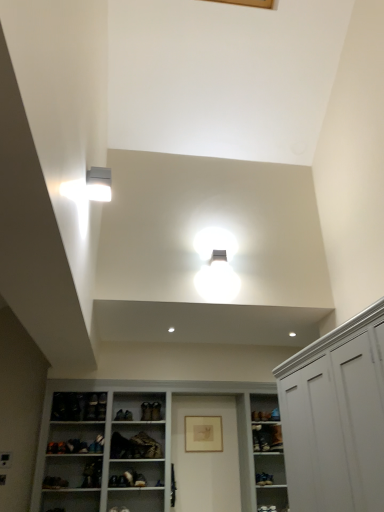
The height and width of the screenshot is (512, 384). In order to click on white plastic light fixture at upper left in this screenshot , I will do `click(98, 184)`.

What is the approximate width of white glossy cupboard at lower center?

white glossy cupboard at lower center is 15.46 inches in width.

Find the location of a particular element. The height and width of the screenshot is (512, 384). white glossy cupboard at lower center is located at coordinates (143, 445).

Where is `leather at center, the 1th shoe when ordered from left to right`? This screenshot has height=512, width=384. leather at center, the 1th shoe when ordered from left to right is located at coordinates (146, 411).

Is white glossy cupboard at lower center to the right of leather at center, acting as the second shoe starting from the right, from the viewer's perspective?

Yes.

Is white glossy cupboard at lower center far from leather at center, acting as the second shoe starting from the right?

No, white glossy cupboard at lower center is not far away from leather at center, acting as the second shoe starting from the right.

Considering the sizes of white glossy cupboard at lower center and leather at center, the 1th shoe when ordered from left to right, in the image, is white glossy cupboard at lower center wider or thinner than leather at center, the 1th shoe when ordered from left to right,?

Considering their sizes, white glossy cupboard at lower center looks broader than leather at center, the 1th shoe when ordered from left to right.

Who is bigger, white glossy cupboard at lower center or leather at center, the 1th shoe when ordered from left to right?

Bigger between the two is white glossy cupboard at lower center.

Is point (159, 411) closer or farther from the camera than point (322, 431)?

Point (159, 411) appears to be farther away from the viewer than point (322, 431).

Locate an element on the screen. cabinetry that is on the right side of leather shoe at center, which is the second shoe from left to right is located at coordinates (336, 418).

Is leather shoe at center, the first shoe when ordered from right to left, inside the boundaries of white matte cabinet at right, or outside?

leather shoe at center, the first shoe when ordered from right to left, is located beyond the bounds of white matte cabinet at right.

Is leather shoe at center, the first shoe when ordered from right to left, positioned in front of white matte cabinet at right?

No, it is not.

Are white matte cabinet at right and leather at center, the 1th shoe when ordered from left to right, making contact?

No.

Is white matte cabinet at right thinner than leather at center, acting as the second shoe starting from the right?

No, white matte cabinet at right is not thinner than leather at center, acting as the second shoe starting from the right.

Considering the relative positions of white matte cabinet at right and leather at center, the 1th shoe when ordered from left to right, in the image provided, is white matte cabinet at right to the right of leather at center, the 1th shoe when ordered from left to right, from the viewer's perspective?

Indeed, white matte cabinet at right is positioned on the right side of leather at center, the 1th shoe when ordered from left to right.

From their relative heights in the image, would you say white matte cabinet at right is taller or shorter than leather at center, the 1th shoe when ordered from left to right?

white matte cabinet at right is taller than leather at center, the 1th shoe when ordered from left to right.

From the picture: Is the depth of matte gold picture frame at center less than that of white plastic light fixture at upper left?

No, matte gold picture frame at center is further to the viewer.

Can you see matte gold picture frame at center touching white plastic light fixture at upper left?

No, matte gold picture frame at center is not beside white plastic light fixture at upper left.

Which is closer, (198, 433) or (105, 193)?

Point (198, 433) is positioned farther from the camera compared to point (105, 193).

Would you say matte gold picture frame at center is to the left or to the right of white plastic light fixture at upper left in the picture?

matte gold picture frame at center is positioned on white plastic light fixture at upper left's right side.

Who is smaller, white glossy cupboard at lower center or white matte cabinet at right?

Smaller between the two is white matte cabinet at right.

Is white glossy cupboard at lower center directly adjacent to white matte cabinet at right?

white glossy cupboard at lower center and white matte cabinet at right are not in contact.

How much distance is there between white glossy cupboard at lower center and white matte cabinet at right?

A distance of 6.64 feet exists between white glossy cupboard at lower center and white matte cabinet at right.

What's the angular difference between white glossy cupboard at lower center and white matte cabinet at right's facing directions?

The angular difference between white glossy cupboard at lower center and white matte cabinet at right is 90.8 degrees.

From a real-world perspective, which is physically below, white glossy cupboard at lower center or leather shoe at center, the first shoe when ordered from right to left?

white glossy cupboard at lower center.

You are a GUI agent. You are given a task and a screenshot of the screen. Output one action in this format:
    pyautogui.click(x=<x>, y=<y>)
    Task: Click on the 1st shoe counting from the left of the white glossy cupboard at lower center
    
    Given the screenshot: What is the action you would take?
    pyautogui.click(x=156, y=411)

What's the angular difference between white glossy cupboard at lower center and leather shoe at center, the first shoe when ordered from right to left,'s facing directions?

There is a 7.9-degree angle between the facing directions of white glossy cupboard at lower center and leather shoe at center, the first shoe when ordered from right to left.

Which of these two, white glossy cupboard at lower center or leather shoe at center, the first shoe when ordered from right to left, stands shorter?

Standing shorter between the two is leather shoe at center, the first shoe when ordered from right to left.

Which is behind, matte gold picture frame at center or white matte cabinet at right?

matte gold picture frame at center.

In terms of height, does matte gold picture frame at center look taller or shorter compared to white matte cabinet at right?

Considering their sizes, matte gold picture frame at center has less height than white matte cabinet at right.

Is the surface of matte gold picture frame at center in direct contact with white matte cabinet at right?

No, matte gold picture frame at center is not making contact with white matte cabinet at right.

From a real-world perspective, does matte gold picture frame at center stand above white matte cabinet at right?

Correct, in the physical world, matte gold picture frame at center is higher than white matte cabinet at right.

From the white glossy cupboard at lower center, count 1st shoes backward and point to it. Please provide its 2D coordinates.

[(146, 411)]

Starting from the white matte cabinet at right, which shoe is the 1st one to the left? Please provide its 2D coordinates.

[(156, 411)]

Which object lies further to the anchor point white matte cabinet at right, white plastic light fixture at upper left or leather shoe at center, which is the second shoe from left to right?

leather shoe at center, which is the second shoe from left to right, is positioned further to the anchor white matte cabinet at right.

From the image, which object appears to be farther from matte gold picture frame at center, white glossy cupboard at lower center or leather shoe at center, the first shoe when ordered from right to left?

white glossy cupboard at lower center.

Looking at the image, which one is located further to white matte cabinet at right, white plastic light fixture at upper left or white glossy cupboard at lower center?

white glossy cupboard at lower center lies further to white matte cabinet at right than the other object.

Considering their positions, is white plastic light fixture at upper left positioned closer to leather at center, acting as the second shoe starting from the right, than white glossy cupboard at lower center?

white glossy cupboard at lower center.

When comparing their distances from leather shoe at center, which is the second shoe from left to right, does matte gold picture frame at center or white matte cabinet at right seem further?

white matte cabinet at right lies further to leather shoe at center, which is the second shoe from left to right, than the other object.

In the scene shown: Based on their spatial positions, is white matte cabinet at right or matte gold picture frame at center further from white plastic light fixture at upper left?

matte gold picture frame at center is positioned further to the anchor white plastic light fixture at upper left.

Considering their positions, is white matte cabinet at right positioned further to leather shoe at center, which is the second shoe from left to right, than matte gold picture frame at center?

white matte cabinet at right.

Looking at the image, which one is located closer to matte gold picture frame at center, leather at center, acting as the second shoe starting from the right, or white matte cabinet at right?

Based on the image, leather at center, acting as the second shoe starting from the right, appears to be nearer to matte gold picture frame at center.

Locate an element on the screen. This screenshot has width=384, height=512. shoe between leather at center, acting as the second shoe starting from the right, and matte gold picture frame at center is located at coordinates (156, 411).

Where is `cupboard positioned between white matte cabinet at right and leather shoe at center, the first shoe when ordered from right to left, from near to far`? cupboard positioned between white matte cabinet at right and leather shoe at center, the first shoe when ordered from right to left, from near to far is located at coordinates (143, 445).

Where is `shoe positioned between white glossy cupboard at lower center and leather shoe at center, the first shoe when ordered from right to left, from near to far`? The image size is (384, 512). shoe positioned between white glossy cupboard at lower center and leather shoe at center, the first shoe when ordered from right to left, from near to far is located at coordinates (146, 411).

Where is `cupboard located between white matte cabinet at right and leather at center, acting as the second shoe starting from the right, in the depth direction`? The width and height of the screenshot is (384, 512). cupboard located between white matte cabinet at right and leather at center, acting as the second shoe starting from the right, in the depth direction is located at coordinates (143, 445).